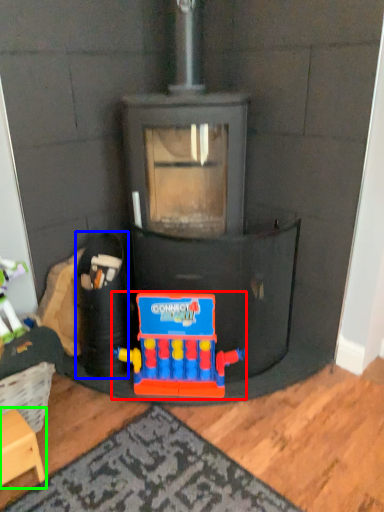
Question: Which object is positioned farthest from toy (highlighted by a red box)? Select from toy (highlighted by a blue box) and furniture (highlighted by a green box).

Choices:
 (A) toy
 (B) furniture

Answer: (B)